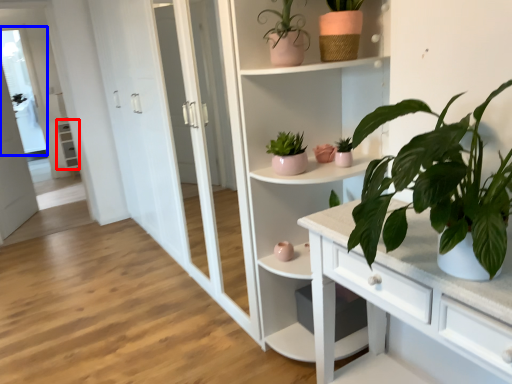
Question: Which point is further to the camera, cabinet (highlighted by a red box) or window (highlighted by a blue box)?

Choices:
 (A) cabinet
 (B) window

Answer: (A)